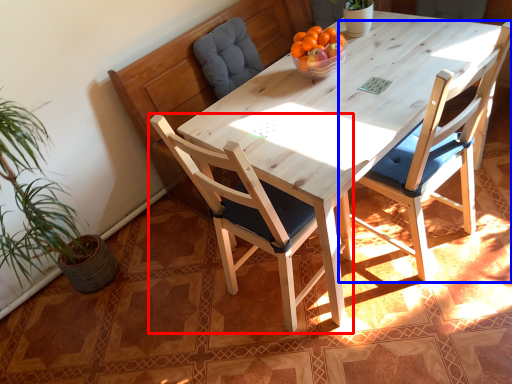
Question: Among these objects, which one is nearest to the camera, chair (highlighted by a red box) or chair (highlighted by a blue box)?

Choices:
 (A) chair
 (B) chair

Answer: (A)